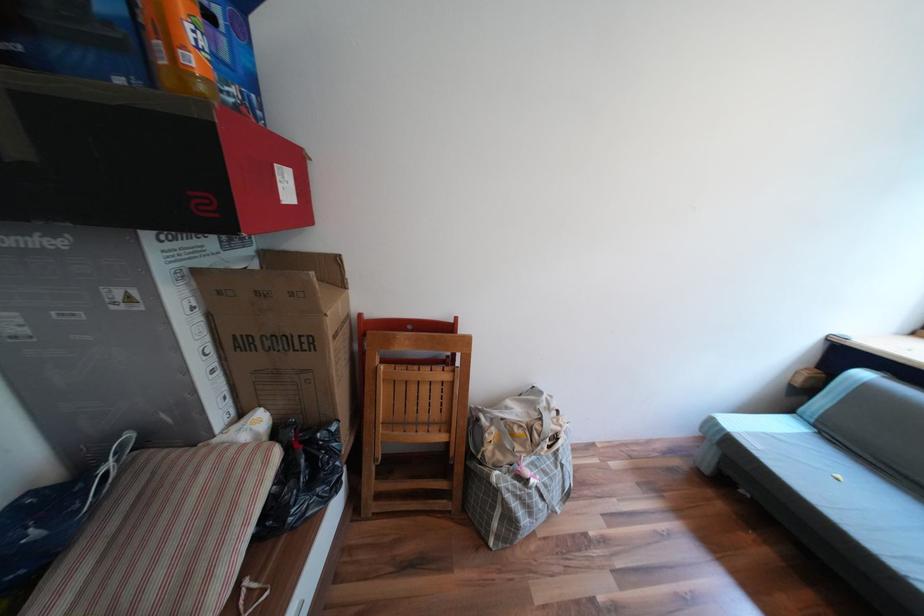
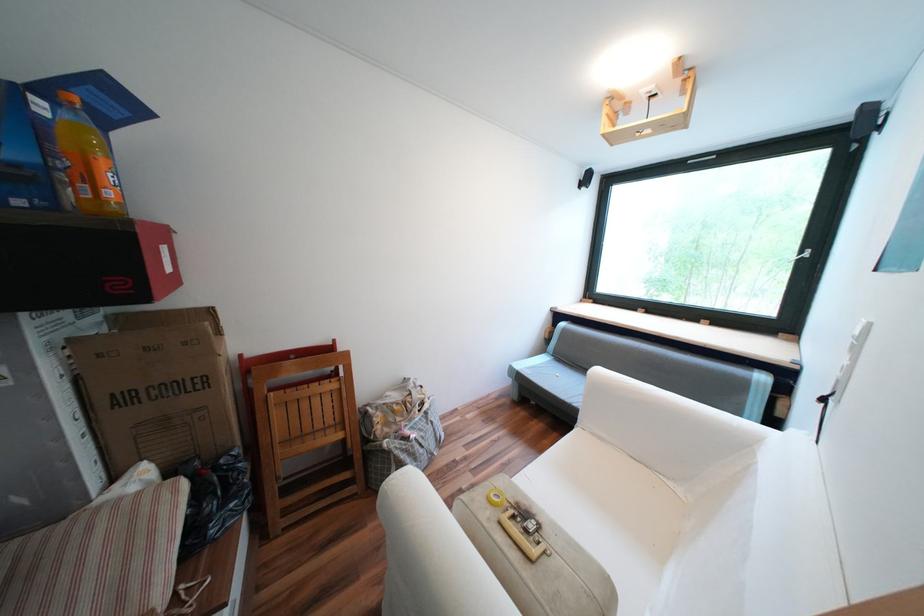
Find the pixel in the second image that matches (x=438, y=368) in the first image.

(325, 383)